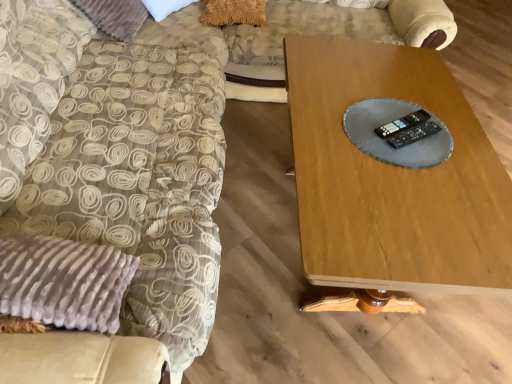
Measure the distance between velvet beige swivel chair at left and camera.

velvet beige swivel chair at left and camera are 79.98 centimeters apart.

Describe the element at coordinates (393, 178) in the screenshot. I see `wooden table at center` at that location.

Describe the element at coordinates (402, 124) in the screenshot. I see `black plastic remote at center, the first control positioned from the top` at that location.

The height and width of the screenshot is (384, 512). Identify the location of black plastic remote at center, the 2th control in the top-to-bottom sequence. (413, 134).

In terms of width, does black plastic remote at center, the 2th control in the top-to-bottom sequence, look wider or thinner when compared to wooden table at center?

Considering their sizes, black plastic remote at center, the 2th control in the top-to-bottom sequence, looks slimmer than wooden table at center.

Is black plastic remote at center, the 2th control in the top-to-bottom sequence, facing away from wooden table at center?

That's not correct — black plastic remote at center, the 2th control in the top-to-bottom sequence, is not looking away from wooden table at center.

Does point (411, 134) come in front of point (450, 225)?

That is False.

Which is behind, black plastic remote at center, which is the first control from bottom to top, or wooden table at center?

black plastic remote at center, which is the first control from bottom to top, is further away from the camera.

Does velvet beige swivel chair at left appear on the right side of wooden table at center?

Incorrect, velvet beige swivel chair at left is not on the right side of wooden table at center.

In the scene shown: Looking at the image, does velvet beige swivel chair at left seem bigger or smaller compared to wooden table at center?

velvet beige swivel chair at left is bigger than wooden table at center.

From the picture: Considering the sizes of objects velvet beige swivel chair at left and wooden table at center in the image provided, who is shorter, velvet beige swivel chair at left or wooden table at center?

With less height is wooden table at center.

Based on the photo, from the image's perspective, who appears lower, velvet beige swivel chair at left or wooden table at center?

wooden table at center appears lower in the image.

Based on the photo, between velvet beige swivel chair at left and black plastic remote at center, the first control positioned from the top, which one appears on the right side from the viewer's perspective?

From the viewer's perspective, black plastic remote at center, the first control positioned from the top, appears more on the right side.

Based on their sizes in the image, would you say velvet beige swivel chair at left is bigger or smaller than black plastic remote at center, which appears as the second control when ordered from the bottom?

Considering their sizes, velvet beige swivel chair at left takes up more space than black plastic remote at center, which appears as the second control when ordered from the bottom.

Which object is wider, velvet beige swivel chair at left or black plastic remote at center, which appears as the second control when ordered from the bottom?

Result: Wider between the two is velvet beige swivel chair at left.

Does velvet beige swivel chair at left have a lesser height compared to black plastic remote at center, which appears as the second control when ordered from the bottom?

Incorrect, the height of velvet beige swivel chair at left does not fall short of that of black plastic remote at center, which appears as the second control when ordered from the bottom.

Does black plastic remote at center, which is the first control from bottom to top, have a smaller size compared to velvet beige swivel chair at left?

Yes, black plastic remote at center, which is the first control from bottom to top, is smaller than velvet beige swivel chair at left.

Visually, is black plastic remote at center, which is the first control from bottom to top, positioned to the left or to the right of velvet beige swivel chair at left?

From the image, it's evident that black plastic remote at center, which is the first control from bottom to top, is to the right of velvet beige swivel chair at left.

From a real-world perspective, between black plastic remote at center, which is the first control from bottom to top, and velvet beige swivel chair at left, who is vertically lower?

velvet beige swivel chair at left, from a real-world perspective.

Based on the photo, is wooden table at center aimed at black plastic remote at center, which appears as the second control when ordered from the bottom?

No, wooden table at center is not turned towards black plastic remote at center, which appears as the second control when ordered from the bottom.

From a real-world perspective, does wooden table at center sit lower than black plastic remote at center, which appears as the second control when ordered from the bottom?

Yes, from a real-world perspective, wooden table at center is below black plastic remote at center, which appears as the second control when ordered from the bottom.

Who is taller, wooden table at center or black plastic remote at center, which appears as the second control when ordered from the bottom?

Standing taller between the two is wooden table at center.

Is there a large distance between wooden table at center and black plastic remote at center, the first control positioned from the top?

Actually, wooden table at center and black plastic remote at center, the first control positioned from the top, are a little close together.

Considering the sizes of objects black plastic remote at center, the first control positioned from the top, and black plastic remote at center, the 2th control in the top-to-bottom sequence, in the image provided, who is taller, black plastic remote at center, the first control positioned from the top, or black plastic remote at center, the 2th control in the top-to-bottom sequence,?

Standing taller between the two is black plastic remote at center, the 2th control in the top-to-bottom sequence.

Locate an element on the screen. The width and height of the screenshot is (512, 384). control behind the black plastic remote at center, the 2th control in the top-to-bottom sequence is located at coordinates (402, 124).

From a real-world perspective, relative to black plastic remote at center, which is the first control from bottom to top, is black plastic remote at center, the first control positioned from the top, vertically above or below?

black plastic remote at center, the first control positioned from the top, is situated lower than black plastic remote at center, which is the first control from bottom to top, in the real world.

How different are the orientations of black plastic remote at center, which appears as the second control when ordered from the bottom, and black plastic remote at center, the 2th control in the top-to-bottom sequence, in degrees?

The angle between the facing direction of black plastic remote at center, which appears as the second control when ordered from the bottom, and the facing direction of black plastic remote at center, the 2th control in the top-to-bottom sequence, is 1.23 degrees.

Is black plastic remote at center, which is the first control from bottom to top, aimed at black plastic remote at center, the first control positioned from the top?

Yes, black plastic remote at center, which is the first control from bottom to top, is aimed at black plastic remote at center, the first control positioned from the top.

Can you tell me how much black plastic remote at center, which is the first control from bottom to top, and black plastic remote at center, which appears as the second control when ordered from the bottom, differ in facing direction?

1.23 degrees separate the facing orientations of black plastic remote at center, which is the first control from bottom to top, and black plastic remote at center, which appears as the second control when ordered from the bottom.

Locate an element on the screen. Image resolution: width=512 pixels, height=384 pixels. control that appears behind the black plastic remote at center, the 2th control in the top-to-bottom sequence is located at coordinates point(402,124).

Which object is positioned more to the left, black plastic remote at center, the 2th control in the top-to-bottom sequence, or black plastic remote at center, the first control positioned from the top?

black plastic remote at center, the first control positioned from the top.

Where is `the 1st control above the wooden table at center (from the image's perspective)`? This screenshot has height=384, width=512. the 1st control above the wooden table at center (from the image's perspective) is located at coordinates (413, 134).

Image resolution: width=512 pixels, height=384 pixels. What are the coordinates of `table directly beneath the velvet beige swivel chair at left (from a real-world perspective)` in the screenshot? It's located at (393, 178).

Based on their spatial positions, is black plastic remote at center, which appears as the second control when ordered from the bottom, or black plastic remote at center, the 2th control in the top-to-bottom sequence, closer to velvet beige swivel chair at left?

Based on the image, black plastic remote at center, which appears as the second control when ordered from the bottom, appears to be nearer to velvet beige swivel chair at left.

Which object lies further to the anchor point black plastic remote at center, the first control positioned from the top, wooden table at center or black plastic remote at center, which is the first control from bottom to top?

wooden table at center.

When comparing their distances from velvet beige swivel chair at left, does wooden table at center or black plastic remote at center, the 2th control in the top-to-bottom sequence, seem further?

The object further to velvet beige swivel chair at left is black plastic remote at center, the 2th control in the top-to-bottom sequence.

From the image, which object appears to be nearer to black plastic remote at center, which is the first control from bottom to top, wooden table at center or black plastic remote at center, which appears as the second control when ordered from the bottom?

Among the two, black plastic remote at center, which appears as the second control when ordered from the bottom, is located nearer to black plastic remote at center, which is the first control from bottom to top.

Considering their positions, is velvet beige swivel chair at left positioned further to black plastic remote at center, the first control positioned from the top, than black plastic remote at center, the 2th control in the top-to-bottom sequence?

Based on the image, velvet beige swivel chair at left appears to be further to black plastic remote at center, the first control positioned from the top.

Based on their spatial positions, is wooden table at center or black plastic remote at center, the first control positioned from the top, further from velvet beige swivel chair at left?

The object further to velvet beige swivel chair at left is black plastic remote at center, the first control positioned from the top.

Considering their positions, is velvet beige swivel chair at left positioned further to wooden table at center than black plastic remote at center, which appears as the second control when ordered from the bottom?

velvet beige swivel chair at left.

In the scene shown: From the image, which object appears to be farther from black plastic remote at center, the 2th control in the top-to-bottom sequence, velvet beige swivel chair at left or wooden table at center?

velvet beige swivel chair at left is positioned further to the anchor black plastic remote at center, the 2th control in the top-to-bottom sequence.

Where is `table situated between velvet beige swivel chair at left and black plastic remote at center, which appears as the second control when ordered from the bottom, from left to right`? This screenshot has height=384, width=512. table situated between velvet beige swivel chair at left and black plastic remote at center, which appears as the second control when ordered from the bottom, from left to right is located at coordinates (393, 178).

You are a GUI agent. You are given a task and a screenshot of the screen. Output one action in this format:
    pyautogui.click(x=<x>, y=<y>)
    Task: Click on the table between velvet beige swivel chair at left and black plastic remote at center, which is the first control from bottom to top, in the horizontal direction
    
    Given the screenshot: What is the action you would take?
    point(393,178)

The height and width of the screenshot is (384, 512). In order to click on control between velvet beige swivel chair at left and black plastic remote at center, the 2th control in the top-to-bottom sequence in this screenshot , I will do `click(402, 124)`.

Find the location of a particular element. control positioned between wooden table at center and black plastic remote at center, the first control positioned from the top, from near to far is located at coordinates (413, 134).